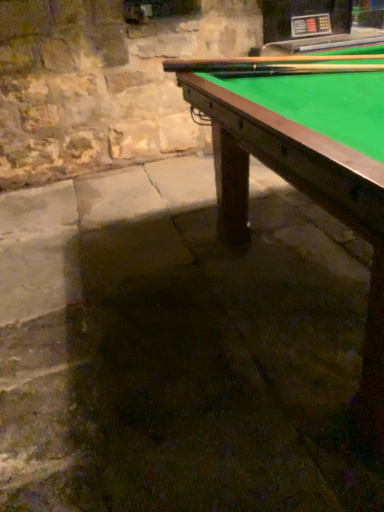
Question: Is the depth of wooden cue at upper right, marked as the 1th cue in a top-to-bottom arrangement, less than that of smooth wood cue at upper right, the 2th cue in the top-to-bottom sequence?

Choices:
 (A) no
 (B) yes

Answer: (B)

Question: Can you confirm if wooden cue at upper right, marked as the 1th cue in a top-to-bottom arrangement, is bigger than smooth wood cue at upper right, which is the first cue from bottom to top?

Choices:
 (A) yes
 (B) no

Answer: (A)

Question: Is wooden cue at upper right, marked as the 1th cue in a top-to-bottom arrangement, to the left of smooth wood cue at upper right, which is the first cue from bottom to top, from the viewer's perspective?

Choices:
 (A) no
 (B) yes

Answer: (B)

Question: From a real-world perspective, is wooden cue at upper right, positioned as the second cue in bottom-to-top order, below smooth wood cue at upper right, the 2th cue in the top-to-bottom sequence?

Choices:
 (A) no
 (B) yes

Answer: (A)

Question: Is wooden cue at upper right, positioned as the second cue in bottom-to-top order, positioned with its back to smooth wood cue at upper right, which is the first cue from bottom to top?

Choices:
 (A) no
 (B) yes

Answer: (A)

Question: Is green felt billiard table at upper right in front of or behind smooth wood cue at upper right, the 2th cue in the top-to-bottom sequence, in the image?

Choices:
 (A) behind
 (B) front

Answer: (B)

Question: Considering the positions of green felt billiard table at upper right and smooth wood cue at upper right, the 2th cue in the top-to-bottom sequence, in the image, is green felt billiard table at upper right bigger or smaller than smooth wood cue at upper right, the 2th cue in the top-to-bottom sequence,?

Choices:
 (A) big
 (B) small

Answer: (A)

Question: Considering the positions of green felt billiard table at upper right and smooth wood cue at upper right, which is the first cue from bottom to top, in the image, is green felt billiard table at upper right taller or shorter than smooth wood cue at upper right, which is the first cue from bottom to top,?

Choices:
 (A) short
 (B) tall

Answer: (B)

Question: Choose the correct answer: Is green felt billiard table at upper right inside smooth wood cue at upper right, which is the first cue from bottom to top, or outside it?

Choices:
 (A) inside
 (B) outside

Answer: (B)

Question: Is smooth wood cue at upper right, which is the first cue from bottom to top, taller or shorter than wooden cue at upper right, positioned as the second cue in bottom-to-top order?

Choices:
 (A) short
 (B) tall

Answer: (B)

Question: Choose the correct answer: Is smooth wood cue at upper right, which is the first cue from bottom to top, inside wooden cue at upper right, positioned as the second cue in bottom-to-top order, or outside it?

Choices:
 (A) outside
 (B) inside

Answer: (A)

Question: From the image's perspective, is smooth wood cue at upper right, the 2th cue in the top-to-bottom sequence, above or below wooden cue at upper right, positioned as the second cue in bottom-to-top order?

Choices:
 (A) below
 (B) above

Answer: (A)

Question: Considering the positions of smooth wood cue at upper right, which is the first cue from bottom to top, and wooden cue at upper right, marked as the 1th cue in a top-to-bottom arrangement, in the image, is smooth wood cue at upper right, which is the first cue from bottom to top, bigger or smaller than wooden cue at upper right, marked as the 1th cue in a top-to-bottom arrangement,?

Choices:
 (A) small
 (B) big

Answer: (A)

Question: Considering the positions of wooden cue at upper right, positioned as the second cue in bottom-to-top order, and smooth wood cue at upper right, which is the first cue from bottom to top, in the image, is wooden cue at upper right, positioned as the second cue in bottom-to-top order, taller or shorter than smooth wood cue at upper right, which is the first cue from bottom to top,?

Choices:
 (A) short
 (B) tall

Answer: (A)

Question: In the image, is wooden cue at upper right, positioned as the second cue in bottom-to-top order, positioned in front of or behind smooth wood cue at upper right, the 2th cue in the top-to-bottom sequence?

Choices:
 (A) front
 (B) behind

Answer: (A)